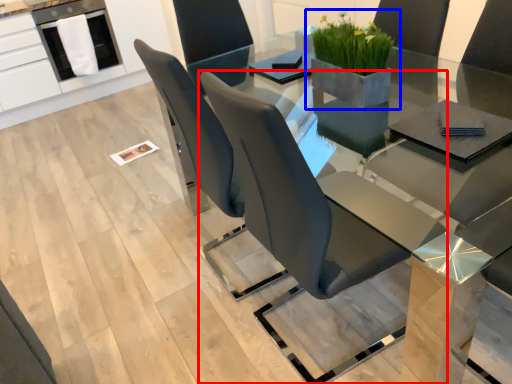
Question: Which object appears closest to the camera in this image, chair (highlighted by a red box) or houseplant (highlighted by a blue box)?

Choices:
 (A) chair
 (B) houseplant

Answer: (A)